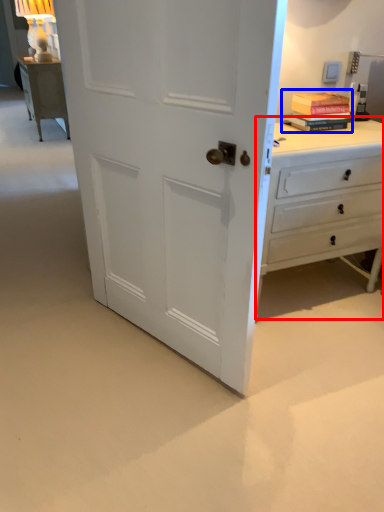
Question: Which of the following is the closest to the observer, chest of drawers (highlighted by a red box) or book (highlighted by a blue box)?

Choices:
 (A) chest of drawers
 (B) book

Answer: (A)